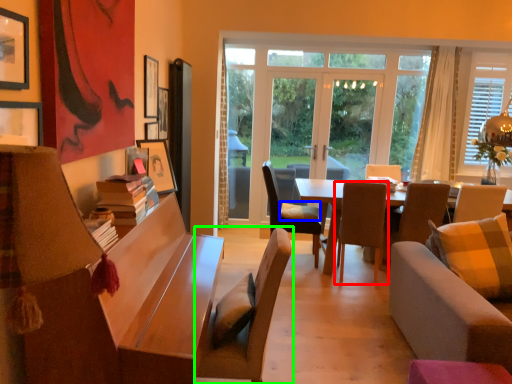
Question: Estimate the real-world distances between objects in this image. Which object is closer to chair (highlighted by a red box), pillow (highlighted by a blue box) or chair (highlighted by a green box)?

Choices:
 (A) pillow
 (B) chair

Answer: (A)